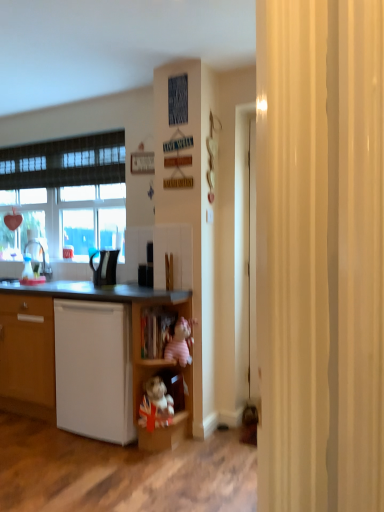
Question: Should I look upward or downward to see white matte dishwasher at lower left?

Choices:
 (A) down
 (B) up

Answer: (A)

Question: Is wooden plush toy at lower center, the 2th cabinet positioned from the top, positioned beyond the bounds of white matte cupboard at lower left?

Choices:
 (A) no
 (B) yes

Answer: (A)

Question: Is there a large distance between wooden plush toy at lower center, which ranks as the 1th cabinet in bottom-to-top order, and white matte cupboard at lower left?

Choices:
 (A) no
 (B) yes

Answer: (A)

Question: Is white matte cupboard at lower left at the back of wooden plush toy at lower center, which ranks as the 1th cabinet in bottom-to-top order?

Choices:
 (A) no
 (B) yes

Answer: (B)

Question: Can you confirm if wooden plush toy at lower center, which ranks as the 1th cabinet in bottom-to-top order, is taller than white matte cupboard at lower left?

Choices:
 (A) no
 (B) yes

Answer: (A)

Question: Considering the relative sizes of wooden plush toy at lower center, which ranks as the 1th cabinet in bottom-to-top order, and white matte cupboard at lower left in the image provided, is wooden plush toy at lower center, which ranks as the 1th cabinet in bottom-to-top order, smaller than white matte cupboard at lower left?

Choices:
 (A) yes
 (B) no

Answer: (A)

Question: From the image's perspective, is wooden plush toy at lower center, the 2th cabinet positioned from the top, over white matte cupboard at lower left?

Choices:
 (A) no
 (B) yes

Answer: (A)

Question: Does white matte cupboard at lower left have a lesser height compared to white matte dishwasher at lower left?

Choices:
 (A) no
 (B) yes

Answer: (A)

Question: Considering the relative sizes of white matte cupboard at lower left and white matte dishwasher at lower left in the image provided, is white matte cupboard at lower left taller than white matte dishwasher at lower left?

Choices:
 (A) no
 (B) yes

Answer: (B)

Question: Would you say white matte dishwasher at lower left is part of white matte cupboard at lower left's contents?

Choices:
 (A) yes
 (B) no

Answer: (A)

Question: From a real-world perspective, is white matte cupboard at lower left physically below white matte dishwasher at lower left?

Choices:
 (A) no
 (B) yes

Answer: (A)

Question: Is white matte cupboard at lower left aimed at white matte dishwasher at lower left?

Choices:
 (A) no
 (B) yes

Answer: (B)

Question: Can you confirm if white matte cupboard at lower left is smaller than white matte dishwasher at lower left?

Choices:
 (A) no
 (B) yes

Answer: (A)

Question: From the image's perspective, is wooden plush toy at lower center, which ranks as the 1th cabinet in bottom-to-top order, on black glossy kettle at center, the first appliance viewed from the left?

Choices:
 (A) yes
 (B) no

Answer: (B)